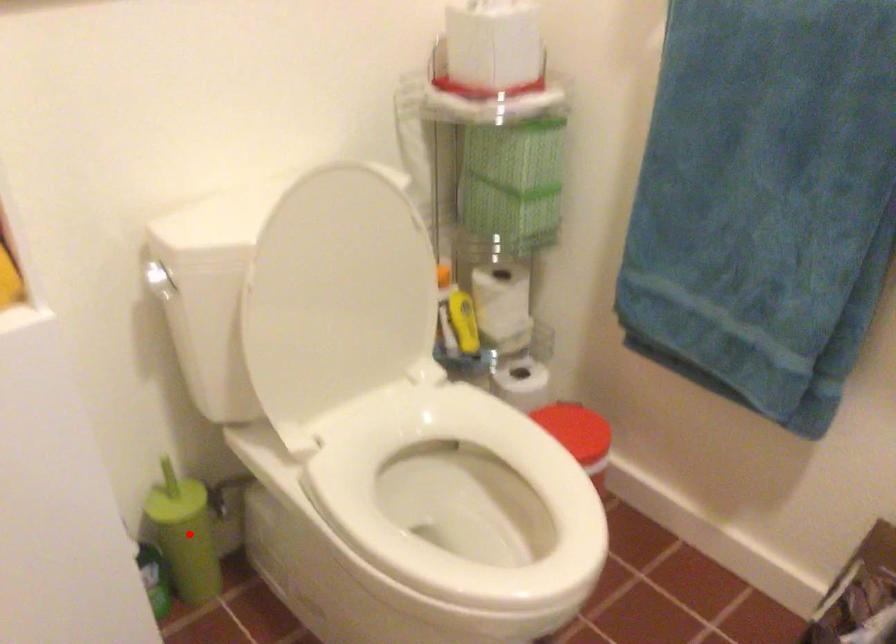
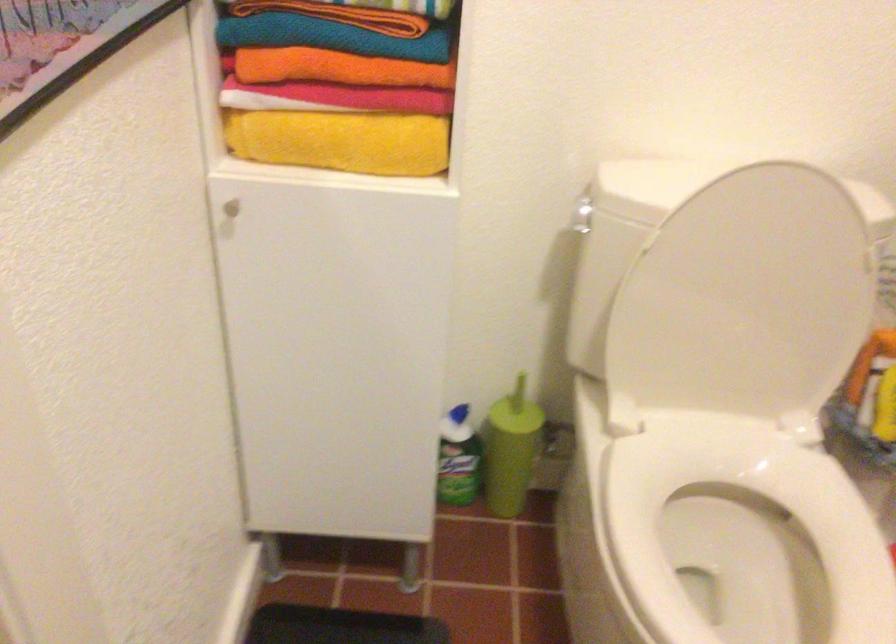
The point at the highlighted location is marked in the first image. Where is the corresponding point in the second image?

(511, 450)